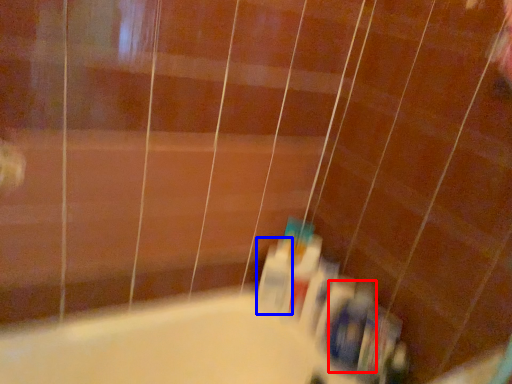
Question: Which point is further to the camera, toiletry (highlighted by a red box) or toiletry (highlighted by a blue box)?

Choices:
 (A) toiletry
 (B) toiletry

Answer: (B)